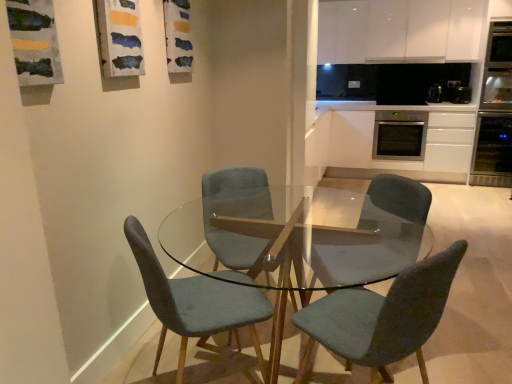
Question: Considering the relative positions of stainless steel oven at center-right and satin black oven at right, placed as the 3th appliance when sorted from right to left, in the image provided, is stainless steel oven at center-right to the left or to the right of satin black oven at right, placed as the 3th appliance when sorted from right to left,?

Choices:
 (A) left
 (B) right

Answer: (A)

Question: Relative to satin black oven at right, placed as the 3th appliance when sorted from right to left, is stainless steel oven at center-right in front or behind?

Choices:
 (A) front
 (B) behind

Answer: (A)

Question: Based on their relative distances, which object is nearer to the satin black oven at right?

Choices:
 (A) transparent glass table at center
 (B) velvet teal chair at center, the first chair viewed from the right
 (C) satin white cabinet at right, acting as the first cabinetry starting from the bottom
 (D) black plastic toaster at upper right, which ranks as the second appliance in right-to-left order
 (E) velvet teal chair at center, placed as the 2th chair when sorted from left to right

Answer: (C)

Question: Considering the real-world distances, which object is closest to the satin black oven at right, which is the 1th appliance from left to right?

Choices:
 (A) stainless steel oven at right, positioned as the third appliance in left-to-right order
 (B) satin black oven at right
 (C) stainless steel oven at center-right
 (D) black plastic toaster at upper right, acting as the 2th appliance starting from the left
 (E) transparent glass table at center

Answer: (D)